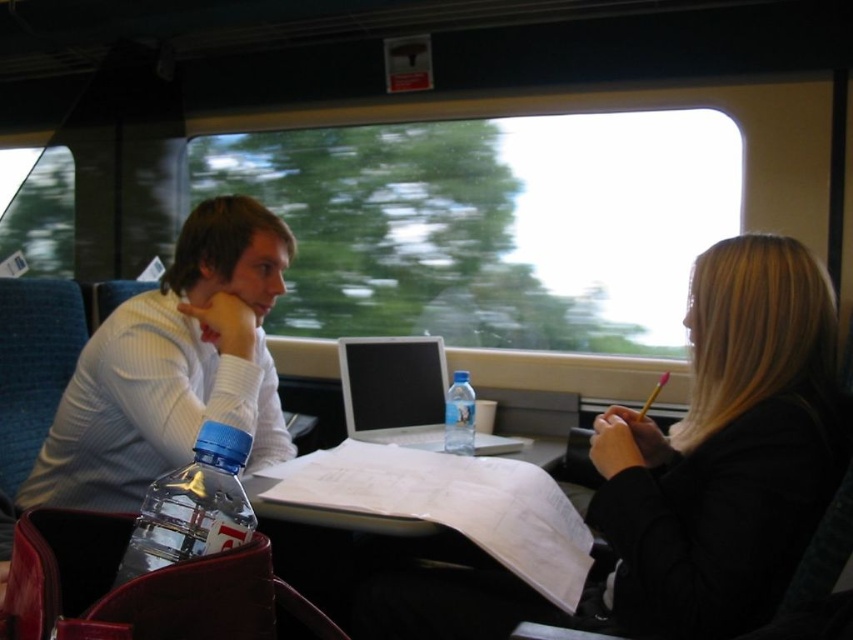
You are standing in the train carriage and want to move from the point at coordinates point (616, 582) to the point at coordinates point (186, 320). Which direction should you move to get closer to your destination?

To move from point (616, 582) to point (186, 320), you should move towards the lower left direction since point (616, 582) is in front of point (186, 320).

You are a passenger on a train and need to place a book on the table between the black matte jacket at right and the silver metallic laptop at center. Which object should you place the book closer to to ensure it doesn

The black matte jacket at right is taller than the silver metallic laptop at center, so placing the book closer to the black matte jacket at right would provide a more stable base to prevent it from falling off the table.